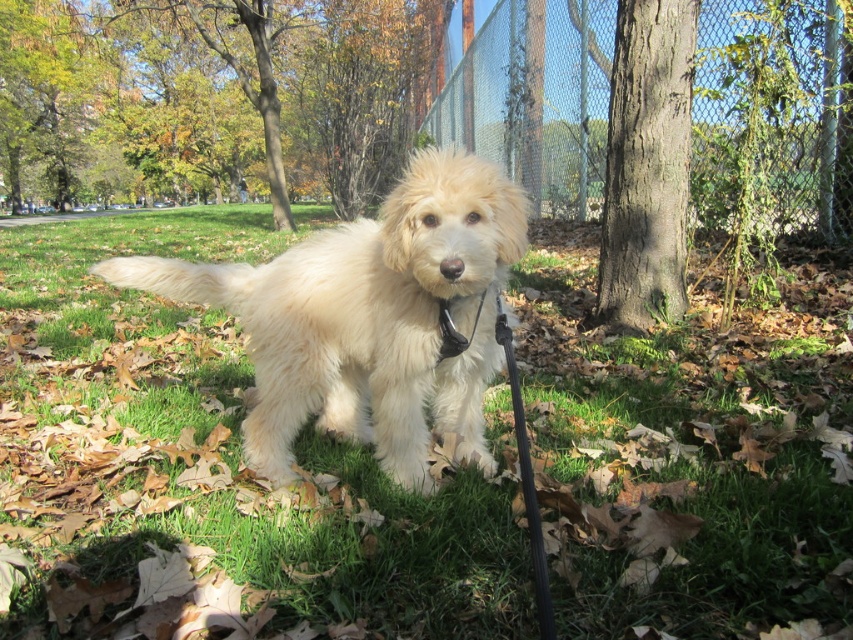
You are a dog owner trying to find the shortest path to retrieve your dog. You see the green grass at center and the black leather neckband at center. Which object is closer to you if you are standing to the right of both?

The black leather neckband at center is closer to you because it is to the right of the green grass at center, so if you are standing to the right of both, the neckband is nearer.

You are standing in the park and see two points marked in the image. Which point, point (473, 528) or point (393, 358), is closer to you?

Point (473, 528) is closer to the viewer than point (393, 358).